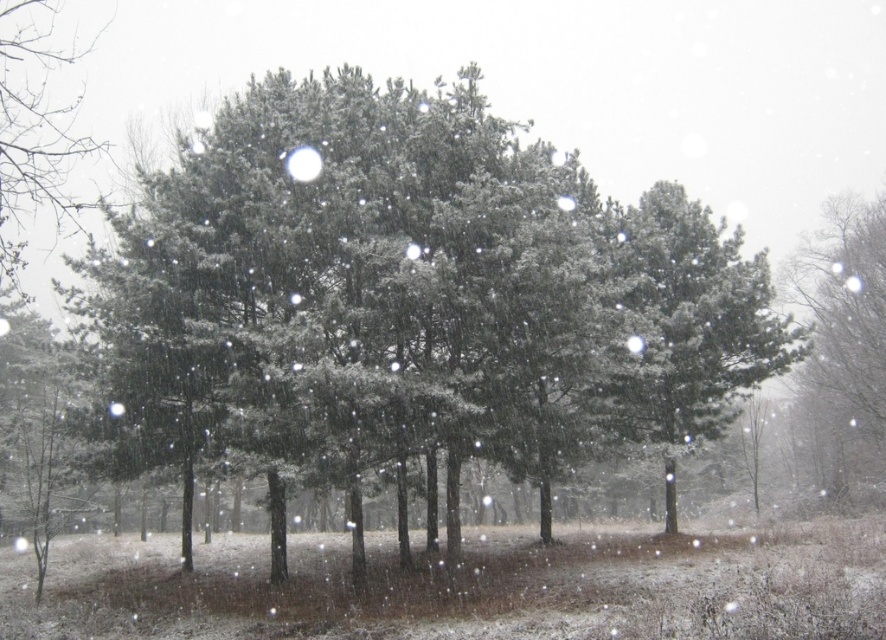
Question: Estimate the real-world distances between objects in this image. Which object is closer to the green matte tree at left?

Choices:
 (A) needle-like green pine at center
 (B) snow-covered pine tree at right

Answer: (A)

Question: Estimate the real-world distances between objects in this image. Which object is closer to the snow-covered pine tree at right?

Choices:
 (A) needle-like green pine at center
 (B) green matte tree at left

Answer: (A)

Question: Which point is closer to the camera taking this photo?

Choices:
 (A) (672, 440)
 (B) (6, 196)

Answer: (A)

Question: From the image, what is the correct spatial relationship of needle-like green pine at center in relation to green matte tree at left?

Choices:
 (A) above
 (B) below

Answer: (B)

Question: Is snow-covered pine tree at right to the right of green matte tree at left from the viewer's perspective?

Choices:
 (A) yes
 (B) no

Answer: (A)

Question: In this image, where is needle-like green pine at center located relative to green matte tree at left?

Choices:
 (A) above
 (B) below

Answer: (B)